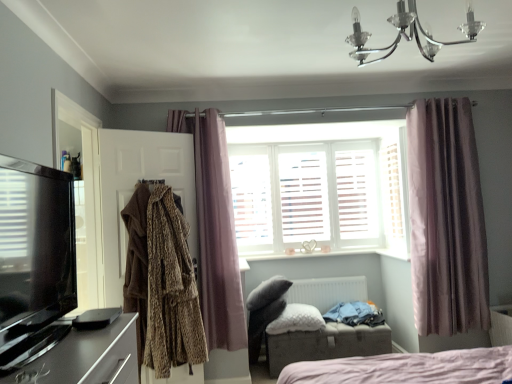
What are the coordinates of `vacant space that's between blue cotton shirt at lower right, which is the 2th clothing in left-to-right order, and white fluffy pillow at center` in the screenshot? It's located at (345, 331).